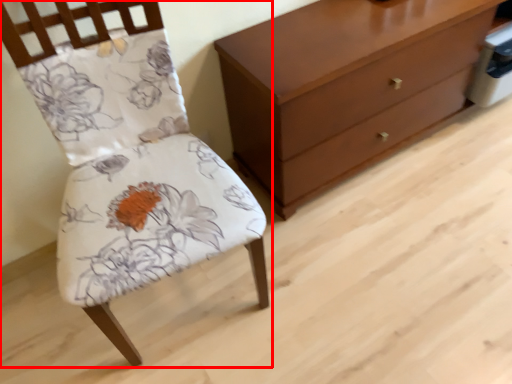
Question: In this image, where is chair (annotated by the red box) located relative to chest of drawers?

Choices:
 (A) right
 (B) left

Answer: (B)